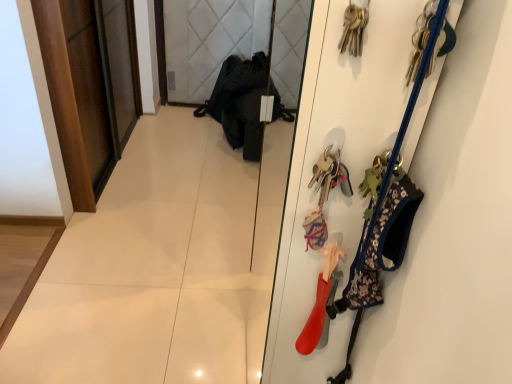
Locate an element on the screen. vacant space in front of dark wood door at left is located at coordinates (x=128, y=232).